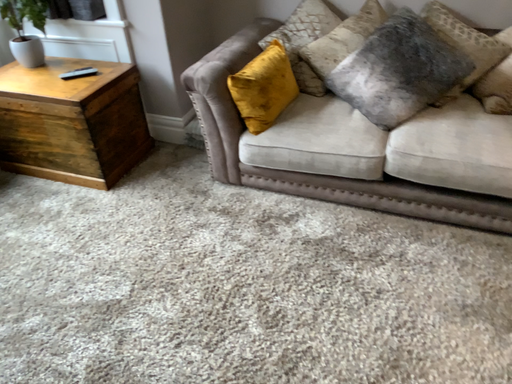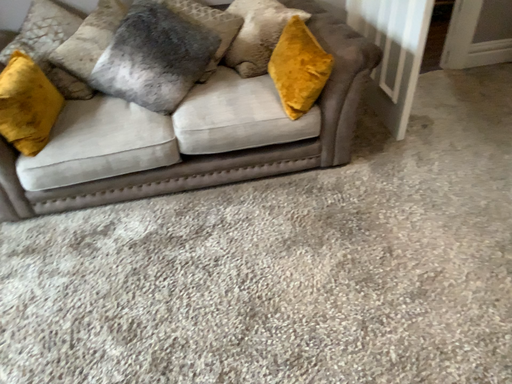
Question: How did the camera likely rotate when shooting the video?

Choices:
 (A) rotated left
 (B) rotated right

Answer: (B)